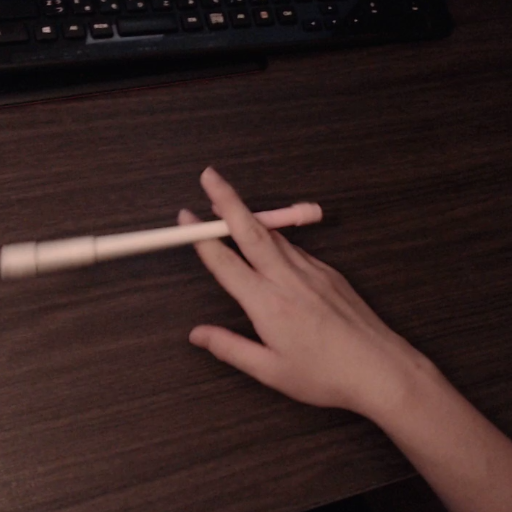
The image size is (512, 512). Find the location of `keyboard`. keyboard is located at coordinates (11, 79).